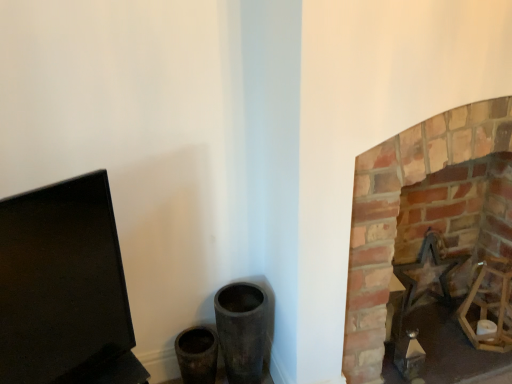
Question: Considering the relative sizes of metallic star at right and brick fireplace at right in the image provided, is metallic star at right thinner than brick fireplace at right?

Choices:
 (A) yes
 (B) no

Answer: (A)

Question: From a real-world perspective, is metallic star at right physically above brick fireplace at right?

Choices:
 (A) no
 (B) yes

Answer: (A)

Question: Can you confirm if metallic star at right is wider than brick fireplace at right?

Choices:
 (A) no
 (B) yes

Answer: (A)

Question: Is metallic star at right next to brick fireplace at right?

Choices:
 (A) no
 (B) yes

Answer: (A)

Question: Can you confirm if metallic star at right is bigger than brick fireplace at right?

Choices:
 (A) yes
 (B) no

Answer: (B)

Question: Is metallic star at right far from brick fireplace at right?

Choices:
 (A) no
 (B) yes

Answer: (A)

Question: From a real-world perspective, is brick fireplace at right on black matte computer monitor at left?

Choices:
 (A) no
 (B) yes

Answer: (A)

Question: Considering the relative sizes of brick fireplace at right and black matte computer monitor at left in the image provided, is brick fireplace at right wider than black matte computer monitor at left?

Choices:
 (A) yes
 (B) no

Answer: (A)

Question: Is black matte computer monitor at left completely or partially inside brick fireplace at right?

Choices:
 (A) no
 (B) yes

Answer: (A)

Question: From a real-world perspective, is brick fireplace at right below black matte computer monitor at left?

Choices:
 (A) yes
 (B) no

Answer: (A)

Question: Can you confirm if brick fireplace at right is shorter than black matte computer monitor at left?

Choices:
 (A) no
 (B) yes

Answer: (A)

Question: From the image's perspective, is brick fireplace at right beneath black matte computer monitor at left?

Choices:
 (A) yes
 (B) no

Answer: (B)

Question: Would you say black matte computer monitor at left is a long distance from brick fireplace at right?

Choices:
 (A) yes
 (B) no

Answer: (B)